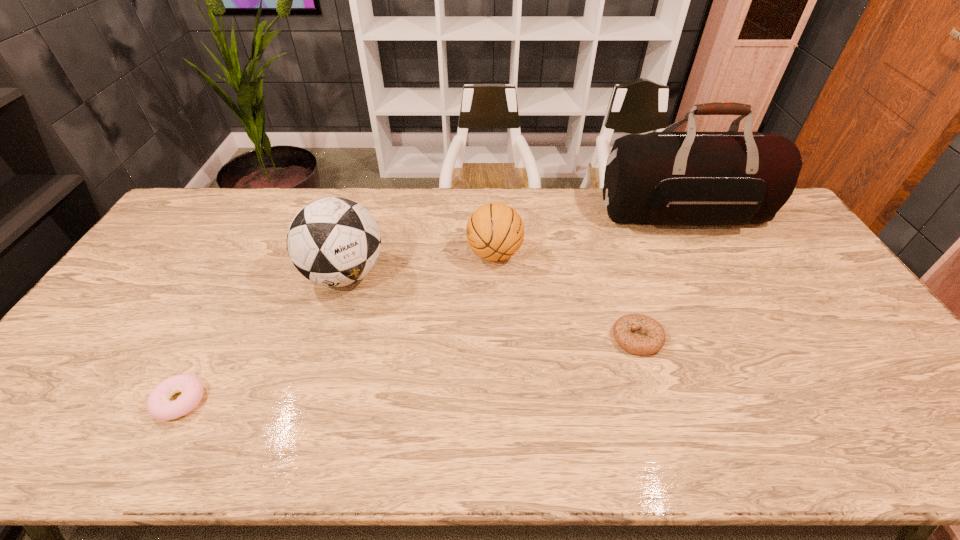
The image size is (960, 540). I want to click on vacant space positioned 0.120m on the surface of the third shortest object near the brand logo, so click(x=429, y=254).

Where is `blank space located 0.260m on the surface of the third shortest object near the brand logo`? The width and height of the screenshot is (960, 540). blank space located 0.260m on the surface of the third shortest object near the brand logo is located at coordinates (386, 254).

The width and height of the screenshot is (960, 540). In order to click on vacant space located 0.250m on the surface of the third shortest object near the brand logo in this screenshot , I will do `click(389, 254)`.

Identify the location of free location located 0.070m on the right of the second nearest object. (688, 338).

Where is `vacant area located 0.400m on the right of the leftmost object`? The width and height of the screenshot is (960, 540). vacant area located 0.400m on the right of the leftmost object is located at coordinates (372, 401).

Locate an element on the screen. The height and width of the screenshot is (540, 960). object located in the far edge section of the desktop is located at coordinates (691, 178).

Where is `object present at the near edge`? This screenshot has height=540, width=960. object present at the near edge is located at coordinates (159, 407).

Where is `object present at the right edge`? object present at the right edge is located at coordinates (691, 178).

Identify the location of object present at the far right corner. This screenshot has width=960, height=540. (691, 178).

This screenshot has width=960, height=540. In the image, there is a desktop. In order to click on vacant space at the far edge in this screenshot , I will do pyautogui.click(x=428, y=215).